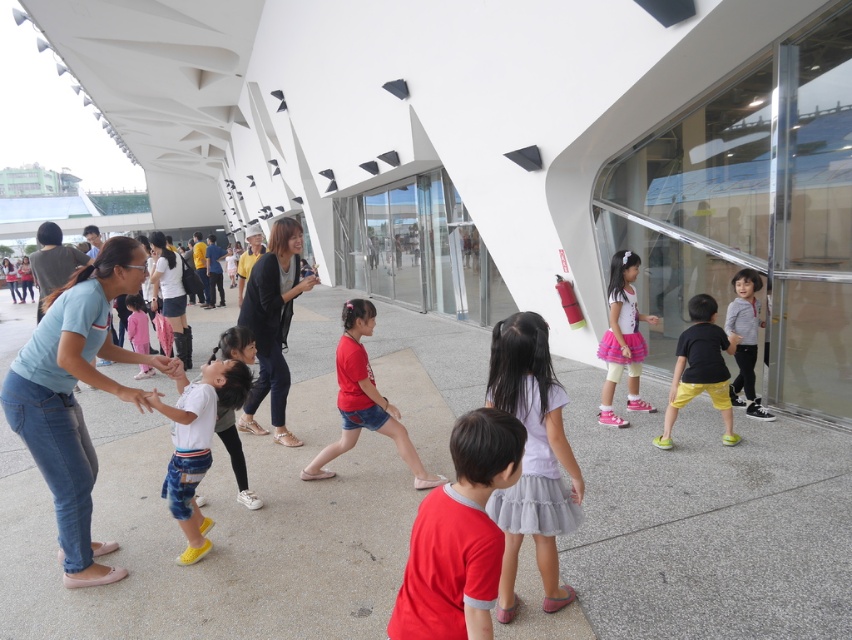
Between pale purple tulle skirt at center and pink fabric dress at center, which one appears on the left side from the viewer's perspective?

pink fabric dress at center is more to the left.

Does pale purple tulle skirt at center have a larger size compared to pink fabric dress at center?

Actually, pale purple tulle skirt at center might be smaller than pink fabric dress at center.

Where is `pale purple tulle skirt at center`? The image size is (852, 640). pale purple tulle skirt at center is located at coordinates (532, 456).

Does point (118, 388) lie in front of point (724, 321)?

Yes, point (118, 388) is in front of point (724, 321).

Who is shorter, light blue denim jeans at lower left or striped cotton shirt at right?

Standing shorter between the two is striped cotton shirt at right.

Which is in front, point (85, 580) or point (744, 323)?

Point (85, 580) is more forward.

Locate an element on the screen. light blue denim jeans at lower left is located at coordinates (73, 396).

Who is taller, red denim shorts at center or matte black shirt at center?

matte black shirt at center

Between point (341, 349) and point (173, 328), which one is positioned in front?

Positioned in front is point (341, 349).

Image resolution: width=852 pixels, height=640 pixels. Find the location of `red denim shorts at center`. red denim shorts at center is located at coordinates (364, 401).